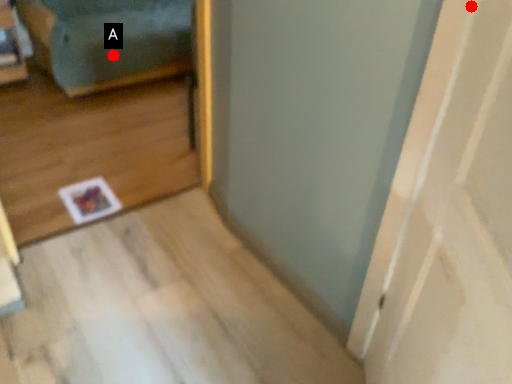
Question: Two points are circled on the image, labeled by A and B beside each circle. Which point is farther from the camera taking this photo?

Choices:
 (A) A is further
 (B) B is further

Answer: (A)